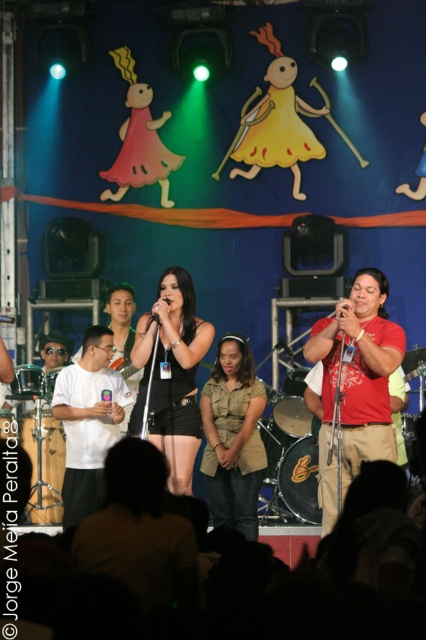
You are a stagehand adjusting the spotlight for the khaki cotton shirt at center and the black matte microphone at center. Since the spotlight can only focus on one object at a time, which object should you adjust the spotlight to first based on their height?

The khaki cotton shirt at center has a greater height compared to the black matte microphone at center, so the spotlight should be adjusted to the khaki cotton shirt at center first to ensure proper illumination.

You are standing at the front of the stage and want to check if you can reach a point marked at coordinates point [247,394] without stepping on the vibrant blue backdrop. Given that the backdrop is 35 feet away from the camera, can you safely reach that point?

The distance of point [247,394] from the camera is 37.24 feet, which is further than the backdrop at 35 feet. Therefore, you cannot reach that point without stepping on the backdrop.